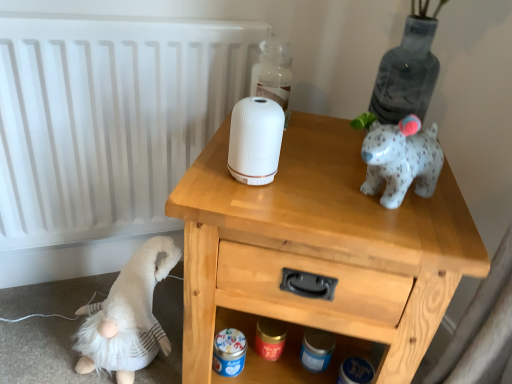
Locate an element on the screen. The height and width of the screenshot is (384, 512). vacant point above white matte radiator at upper left (from a real-world perspective) is located at coordinates (81, 13).